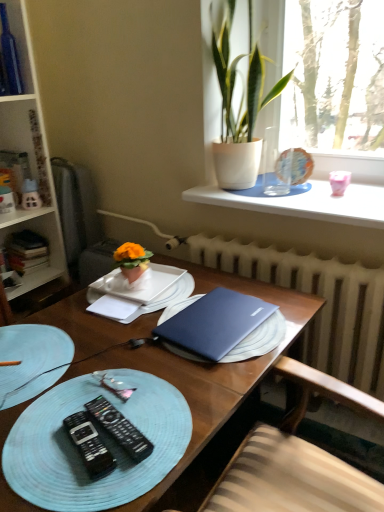
Find the location of a particular element. This screenshot has width=384, height=512. empty space that is in between black plastic remote control at lower left, acting as the second remote control starting from the right, and white matte notebook at center is located at coordinates (105, 360).